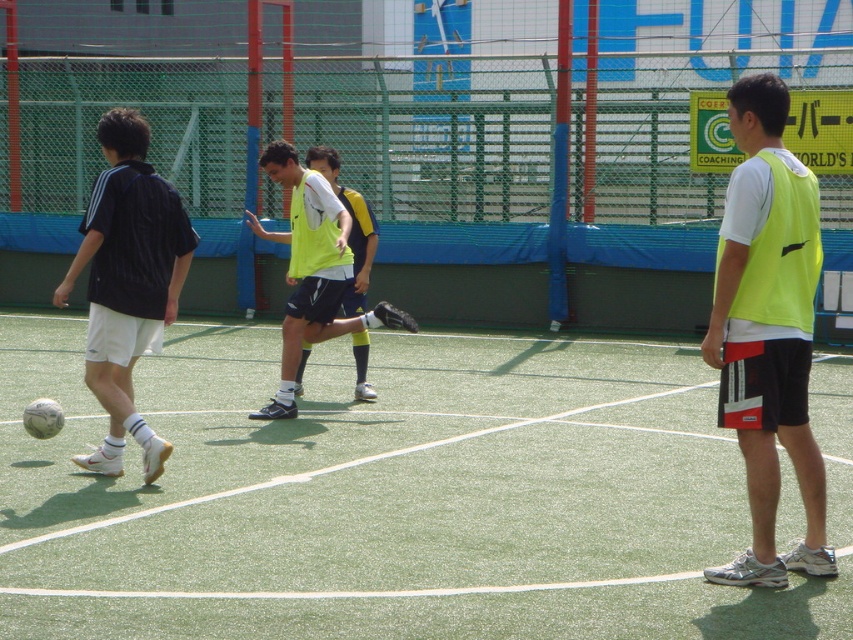
From the picture: You are a soccer coach observing the field. You notice the neon yellow vest at right and the black matte shirt at left. Which piece of clothing appears to be closer to the camera based on their sizes?

The neon yellow vest at right is smaller than the black matte shirt at left, so it appears farther away from the camera since smaller objects in the distance often look smaller.

You are a soccer coach observing the practice from the sidelines. You notice the green artificial turf at center and the neon yellow vest at right. Which object is positioned closer to your viewpoint?

The green artificial turf at center is closer to the viewer than the neon yellow vest at right.

You are a soccer coach observing the practice. You notice the black matte shirt at left and the neon yellow jersey at center. Which player is closer to the ground?

The black matte shirt at left is positioned under the neon yellow jersey at center, so the player wearing the black matte shirt at left is closer to the ground.